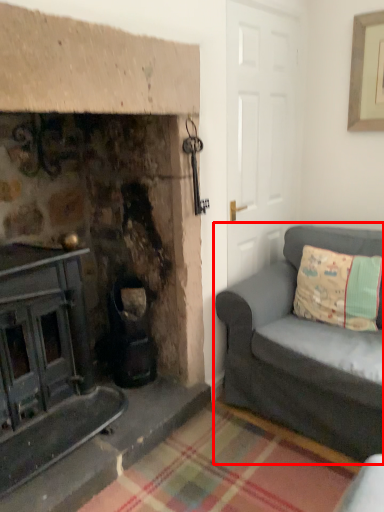
Question: From the image's perspective, considering the relative positions of studio couch (annotated by the red box) and pillow in the image provided, where is studio couch (annotated by the red box) located with respect to the staircase?

Choices:
 (A) below
 (B) above

Answer: (A)